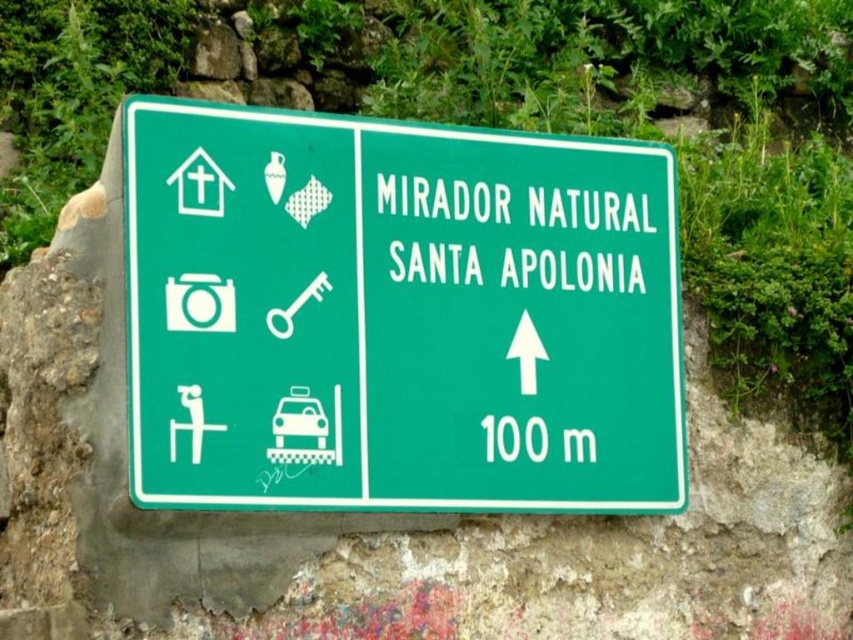
Which of these two, green matte sign at center or matte white taxi at center, stands shorter?

Standing shorter between the two is matte white taxi at center.

Who is lower down, green matte sign at center or matte white taxi at center?

matte white taxi at center is below.

Is point (463, 477) positioned after point (315, 422)?

Yes, point (463, 477) is farther from viewer.

Where is `green matte sign at center`? This screenshot has height=640, width=853. green matte sign at center is located at coordinates (399, 314).